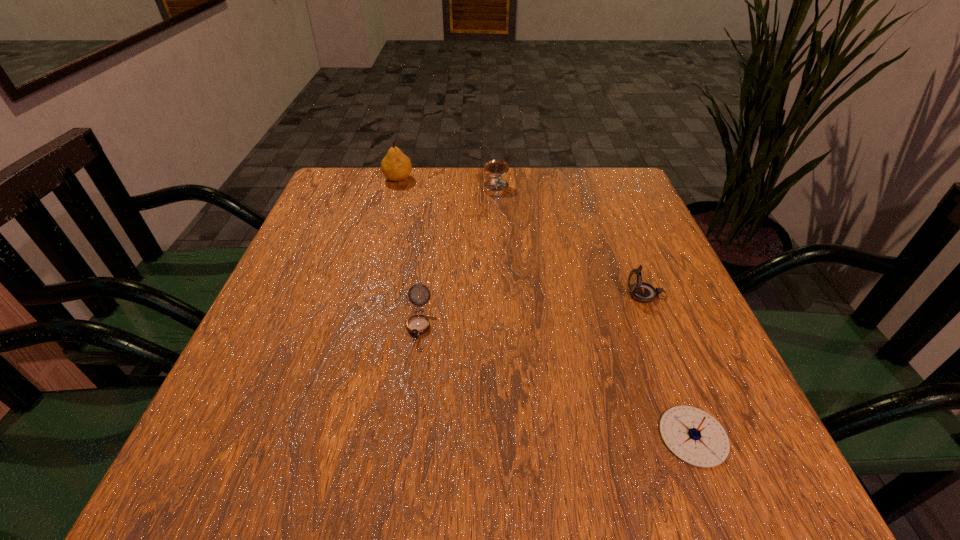
Select which object appears as the fourth closest to the fourth object from right to left. Please provide its 2D coordinates. Your answer should be formatted as a tuple, i.e. [(x, y)], where the tuple contains the x and y coordinates of a point satisfying the conditions above.

[(396, 166)]

Identify the location of object identified as the fourth closest to the farthest compass. (694, 436).

Locate which compass ranks third in proximity to the third object from right to left. Please provide its 2D coordinates. Your answer should be formatted as a tuple, i.e. [(x, y)], where the tuple contains the x and y coordinates of a point satisfying the conditions above.

[(694, 436)]

This screenshot has height=540, width=960. What are the coordinates of `compass that is the closest to the tallest object` in the screenshot? It's located at (496, 187).

Find the location of `blank area in the image that satisfies the following two spatial constraints: 1. with the dial facing the nearest object; 2. on the left side of the third compass from right to left`. blank area in the image that satisfies the following two spatial constraints: 1. with the dial facing the nearest object; 2. on the left side of the third compass from right to left is located at coordinates (509, 436).